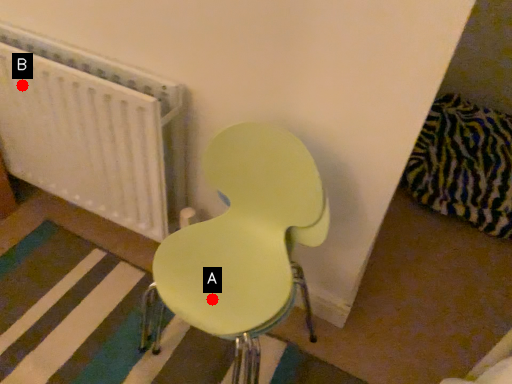
Question: Two points are circled on the image, labeled by A and B beside each circle. Which of the following is the farthest from the observer?

Choices:
 (A) A is further
 (B) B is further

Answer: (B)